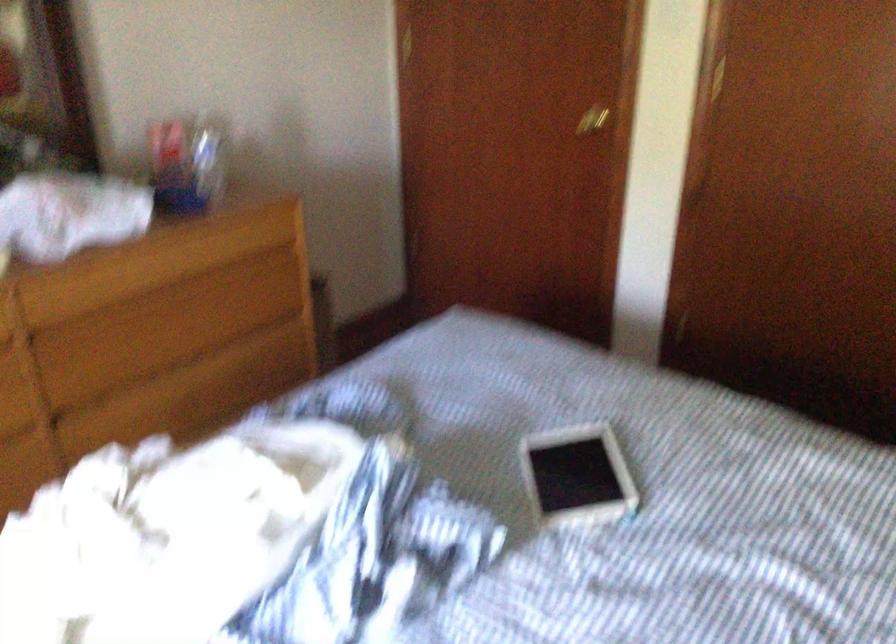
Where would you pull the gold door handle? Please return your answer as a coordinate pair (x, y).

(592, 120)